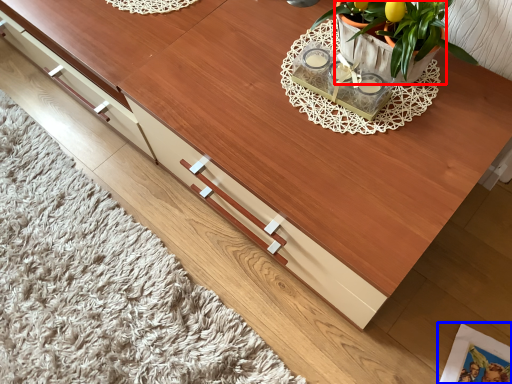
Question: Which object is further to the camera taking this photo, flowerpot (highlighted by a red box) or magazine (highlighted by a blue box)?

Choices:
 (A) flowerpot
 (B) magazine

Answer: (B)